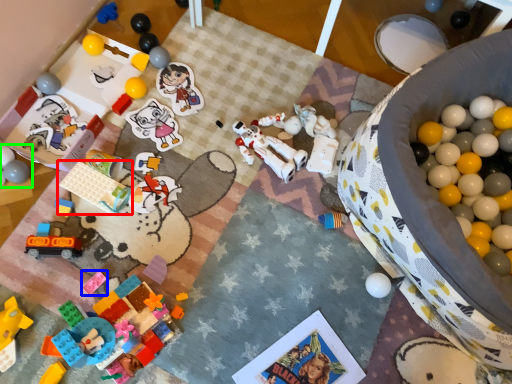
Question: Which object is the farthest from toy (highlighted by a red box)? Choose among these: toy (highlighted by a blue box) or toy (highlighted by a green box).

Choices:
 (A) toy
 (B) toy

Answer: (A)